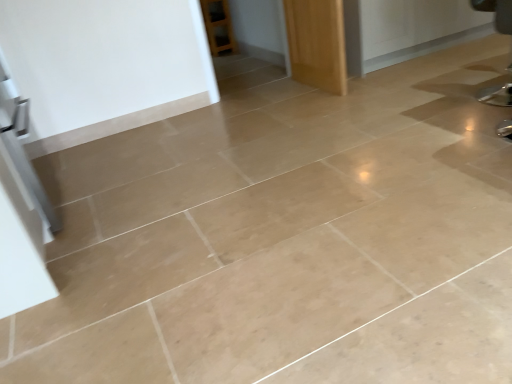
Question: Should I look upward or downward to see wooden door at upper center?

Choices:
 (A) up
 (B) down

Answer: (A)

Question: Would you say wooden door at upper center contains metallic silver swivel chair at right?

Choices:
 (A) yes
 (B) no

Answer: (B)

Question: Can you confirm if wooden door at upper center is thinner than metallic silver swivel chair at right?

Choices:
 (A) no
 (B) yes

Answer: (B)

Question: From the image's perspective, is wooden door at upper center located above metallic silver swivel chair at right?

Choices:
 (A) no
 (B) yes

Answer: (B)

Question: Is wooden door at upper center further to the viewer compared to metallic silver swivel chair at right?

Choices:
 (A) no
 (B) yes

Answer: (B)

Question: Considering the relative sizes of wooden door at upper center and metallic silver swivel chair at right in the image provided, is wooden door at upper center bigger than metallic silver swivel chair at right?

Choices:
 (A) no
 (B) yes

Answer: (B)

Question: From a real-world perspective, is wooden door at upper center under metallic silver swivel chair at right?

Choices:
 (A) yes
 (B) no

Answer: (A)

Question: Is metallic silver swivel chair at right at the left side of wooden door at upper center?

Choices:
 (A) yes
 (B) no

Answer: (B)

Question: From the image's perspective, is metallic silver swivel chair at right on top of wooden door at upper center?

Choices:
 (A) yes
 (B) no

Answer: (B)

Question: Does metallic silver swivel chair at right lie behind wooden door at upper center?

Choices:
 (A) yes
 (B) no

Answer: (B)

Question: Is metallic silver swivel chair at right completely or partially outside of wooden door at upper center?

Choices:
 (A) yes
 (B) no

Answer: (A)

Question: Would you say metallic silver swivel chair at right contains wooden door at upper center?

Choices:
 (A) no
 (B) yes

Answer: (A)

Question: Considering the relative sizes of metallic silver swivel chair at right and wooden door at upper center in the image provided, is metallic silver swivel chair at right smaller than wooden door at upper center?

Choices:
 (A) no
 (B) yes

Answer: (B)

Question: Looking at the image, does wooden door at upper center seem bigger or smaller compared to metallic silver swivel chair at right?

Choices:
 (A) small
 (B) big

Answer: (B)